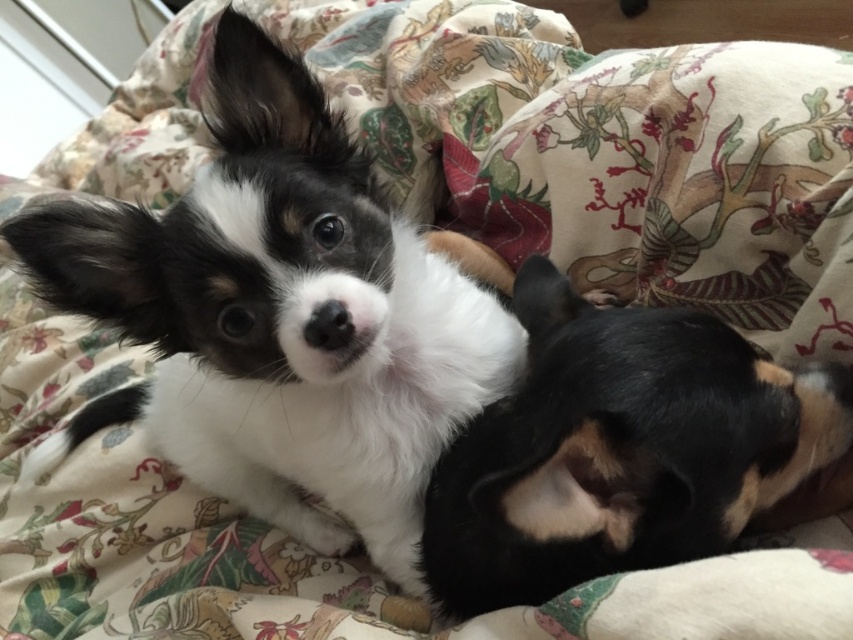
Question: Does black and white fur at upper left appear over black soft fur dog at lower right?

Choices:
 (A) yes
 (B) no

Answer: (A)

Question: Among these objects, which one is farthest from the camera?

Choices:
 (A) black soft fur dog at lower right
 (B) black and white fur at upper left

Answer: (B)

Question: Which point is closer to the camera?

Choices:
 (A) (173, 275)
 (B) (764, 445)

Answer: (B)

Question: Observing the image, what is the correct spatial positioning of black and white fur at upper left in reference to black soft fur dog at lower right?

Choices:
 (A) right
 (B) left

Answer: (B)

Question: Does black and white fur at upper left have a smaller size compared to black soft fur dog at lower right?

Choices:
 (A) yes
 (B) no

Answer: (B)